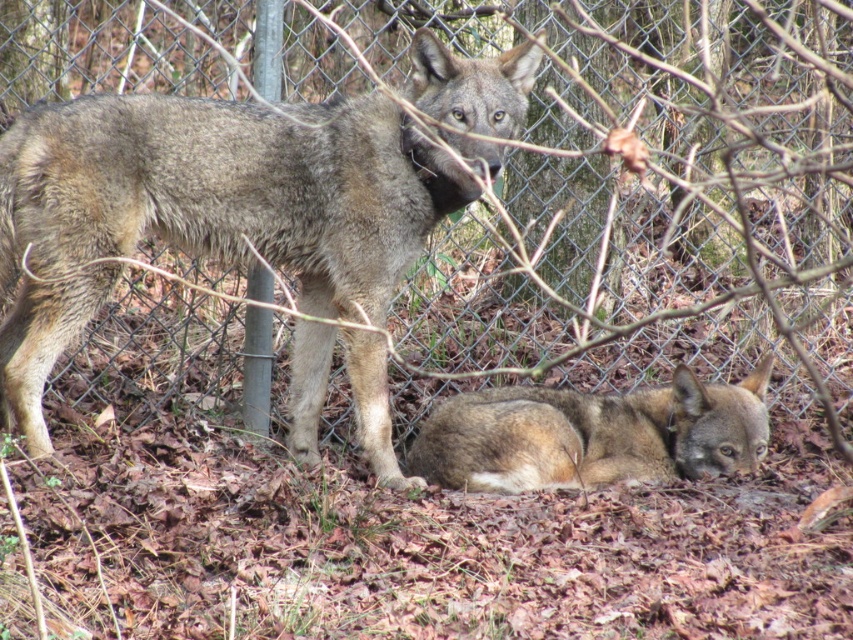
Question: Which point is farther from the camera taking this photo?

Choices:
 (A) (347, 221)
 (B) (515, 438)

Answer: (B)

Question: Does gray fur wolf at center have a smaller size compared to fuzzy brown fur at lower center?

Choices:
 (A) yes
 (B) no

Answer: (B)

Question: Which point is farther to the camera?

Choices:
 (A) gray fur wolf at center
 (B) fuzzy brown fur at lower center

Answer: (B)

Question: Which point is farther to the camera?

Choices:
 (A) (479, 467)
 (B) (15, 218)

Answer: (A)

Question: Can you confirm if gray fur wolf at center is wider than fuzzy brown fur at lower center?

Choices:
 (A) yes
 (B) no

Answer: (A)

Question: Can you confirm if gray fur wolf at center is positioned below fuzzy brown fur at lower center?

Choices:
 (A) yes
 (B) no

Answer: (B)